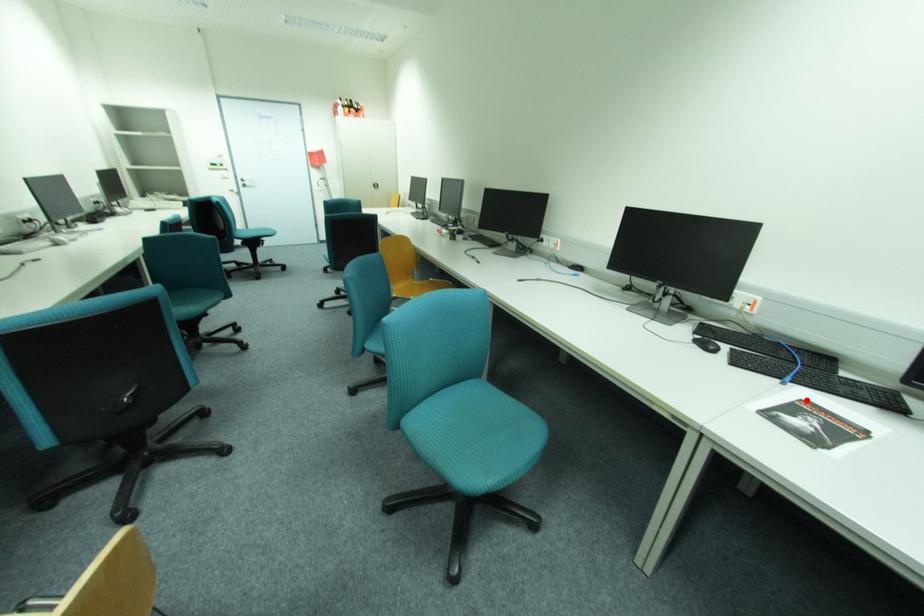
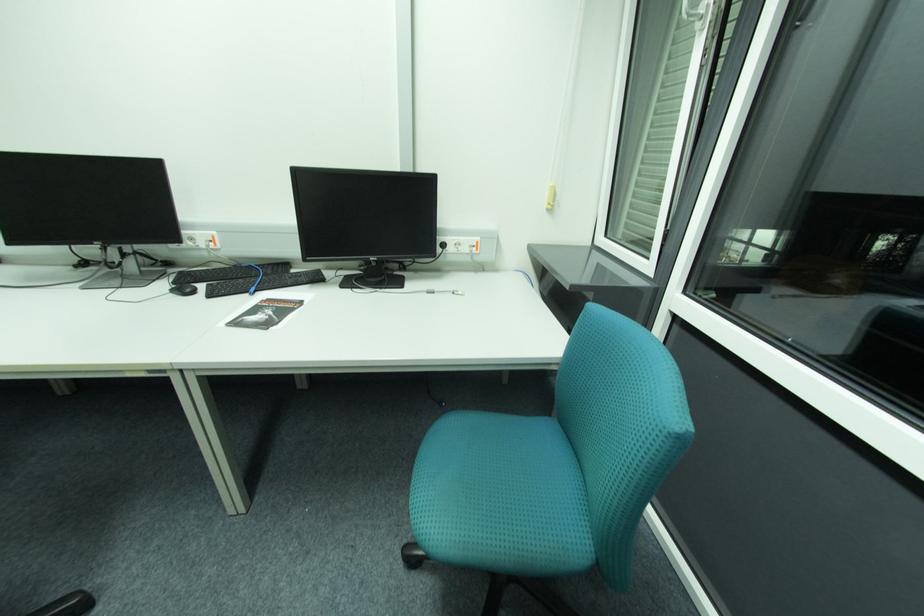
Where in the second image is the point corresponding to the highlighted location from the first image?

(270, 301)